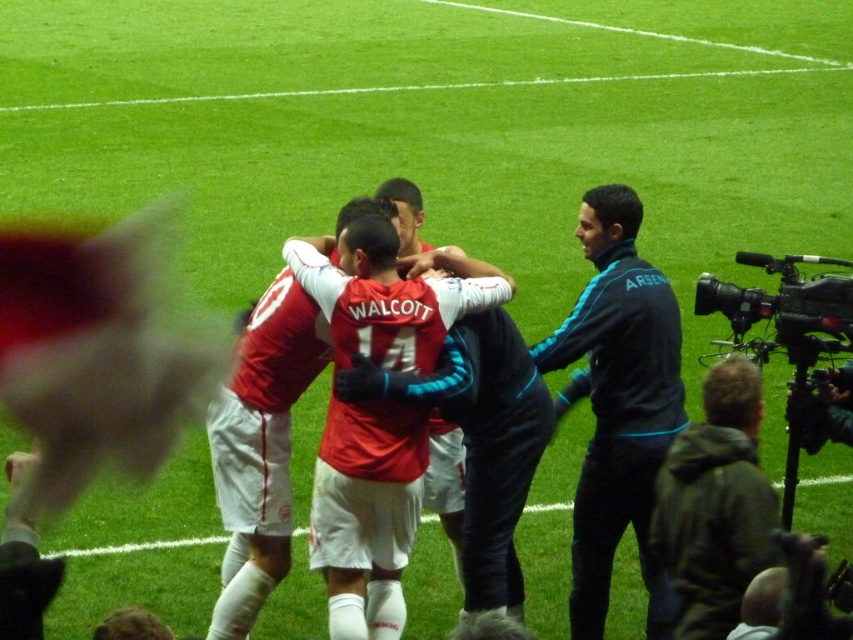
Who is higher up, blue synthetic jacket at right or dark gray hoodie at lower right?

blue synthetic jacket at right is higher up.

Consider the image. Is blue synthetic jacket at right bigger than dark gray hoodie at lower right?

Yes.

Does point (596, 268) come farther from viewer compared to point (666, 529)?

Yes, it is behind point (666, 529).

Where is `blue synthetic jacket at right`? blue synthetic jacket at right is located at coordinates (618, 404).

Does dark gray hoodie at lower right appear over black plastic video camera at right?

No.

Can you confirm if dark gray hoodie at lower right is bigger than black plastic video camera at right?

No, dark gray hoodie at lower right is not bigger than black plastic video camera at right.

Find the location of a particular element. The image size is (853, 640). dark gray hoodie at lower right is located at coordinates (715, 504).

Based on the photo, can you confirm if blue synthetic jacket at right is wider than matte red jersey at center?

Correct, the width of blue synthetic jacket at right exceeds that of matte red jersey at center.

Does blue synthetic jacket at right appear on the left side of matte red jersey at center?

In fact, blue synthetic jacket at right is to the right of matte red jersey at center.

Where is `blue synthetic jacket at right`? blue synthetic jacket at right is located at coordinates (618, 404).

Find the location of a particular element. blue synthetic jacket at right is located at coordinates (618, 404).